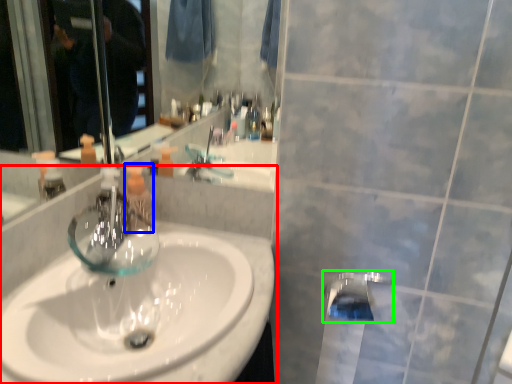
Question: Which object is the farthest from sink (highlighted by a red box)? Choose among these: mouthwash (highlighted by a blue box) or tap (highlighted by a green box).

Choices:
 (A) mouthwash
 (B) tap

Answer: (B)